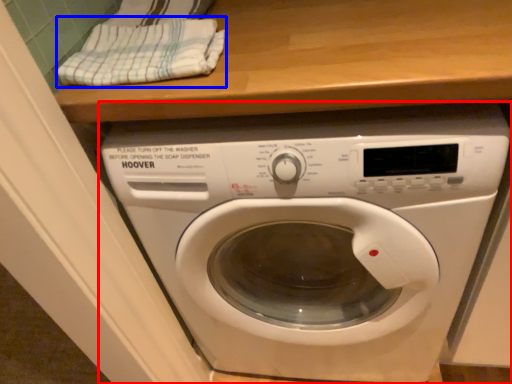
Question: Which object is further to the camera taking this photo, washing machine (highlighted by a red box) or clothe (highlighted by a blue box)?

Choices:
 (A) washing machine
 (B) clothe

Answer: (B)